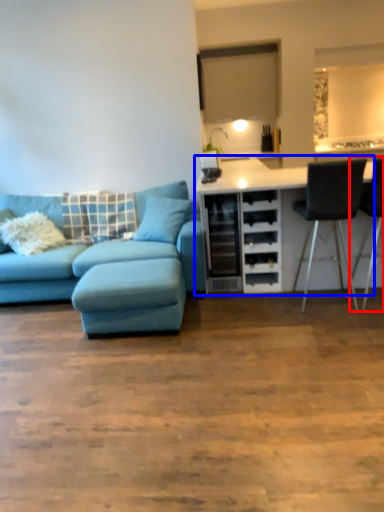
Question: Which object is further to the camera taking this photo, chair (highlighted by a red box) or cabinetry (highlighted by a blue box)?

Choices:
 (A) chair
 (B) cabinetry

Answer: (B)